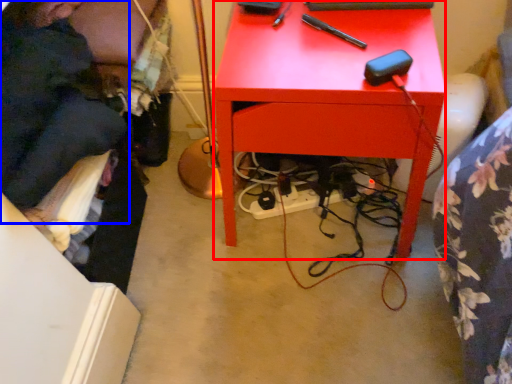
Question: Which object is closer to the camera taking this photo, desk (highlighted by a red box) or person (highlighted by a blue box)?

Choices:
 (A) desk
 (B) person

Answer: (A)